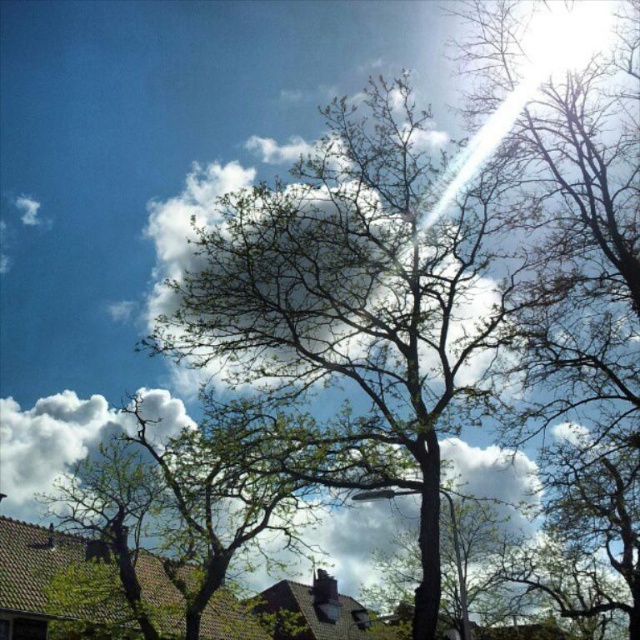
Is green leafy tree at center shorter than white fluffy cloud at upper left?

Indeed, green leafy tree at center has a lesser height compared to white fluffy cloud at upper left.

At what (x,y) coordinates should I click in order to perform the action: click on green leafy tree at center. Please return your answer as a coordinate pair (x, y). Looking at the image, I should click on (355, 289).